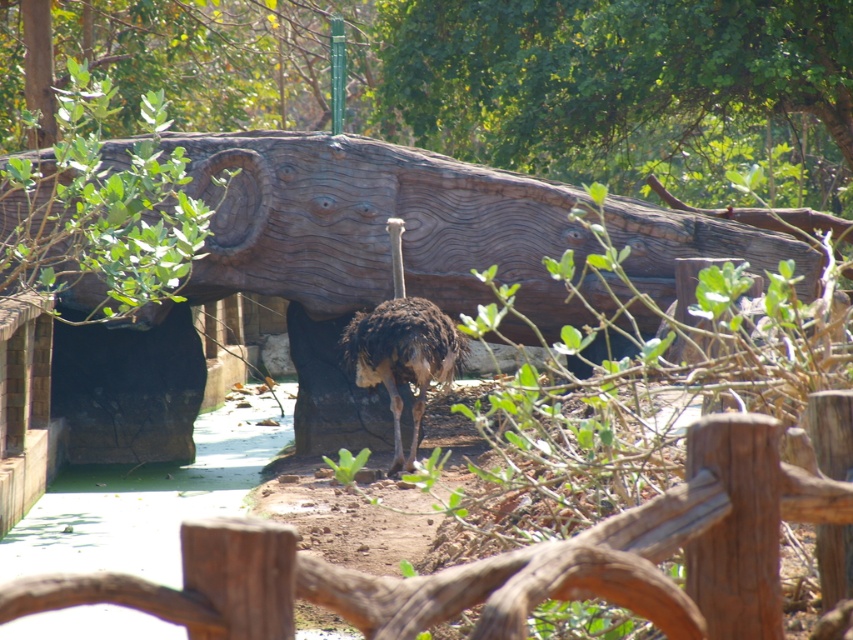
Question: Which object appears farthest from the camera in this image?

Choices:
 (A) wooden log at center
 (B) brown feathered ostrich at center
 (C) brown wooden fence at center

Answer: (A)

Question: Among these points, which one is nearest to the camera?

Choices:
 (A) (592, 573)
 (B) (268, 179)

Answer: (A)

Question: Among these points, which one is nearest to the camera?

Choices:
 (A) pyautogui.click(x=776, y=554)
 (B) pyautogui.click(x=397, y=284)

Answer: (A)

Question: Is brown wooden fence at center to the right of brown feathered ostrich at center from the viewer's perspective?

Choices:
 (A) no
 (B) yes

Answer: (B)

Question: Is wooden log at center closer to the viewer compared to brown wooden fence at center?

Choices:
 (A) no
 (B) yes

Answer: (A)

Question: Is wooden log at center above brown feathered ostrich at center?

Choices:
 (A) yes
 (B) no

Answer: (A)